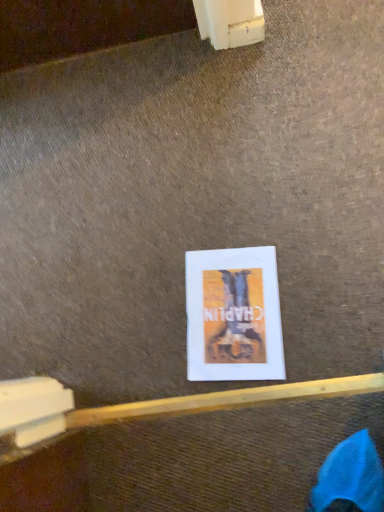
Where is `vacant region to the right of white paper at center`? vacant region to the right of white paper at center is located at coordinates (308, 250).